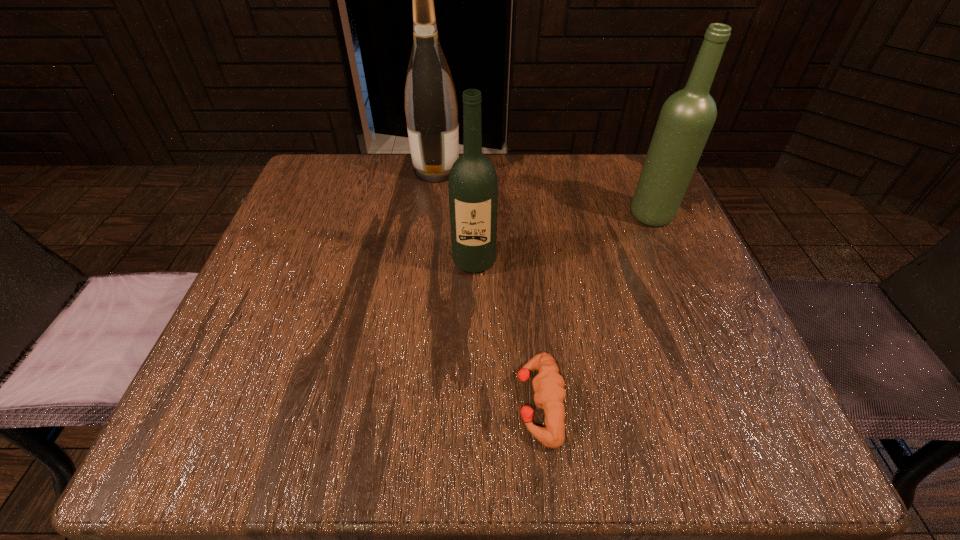
Locate an element on the screen. This screenshot has width=960, height=540. free space located 0.330m with the gloves of the puncher facing forward is located at coordinates (291, 403).

The height and width of the screenshot is (540, 960). Find the location of `free space located 0.390m with the gloves of the puncher facing forward`. free space located 0.390m with the gloves of the puncher facing forward is located at coordinates (250, 403).

You are a GUI agent. You are given a task and a screenshot of the screen. Output one action in this format:
    pyautogui.click(x=<x>, y=<y>)
    Task: Click on the object that is positioned at the near edge
    
    Given the screenshot: What is the action you would take?
    pyautogui.click(x=548, y=384)

The image size is (960, 540). What are the coordinates of `object at the right edge` in the screenshot? It's located at (687, 117).

Where is `object that is at the far right corner`? object that is at the far right corner is located at coordinates (687, 117).

In the image, there is a desktop. At what (x,y) coordinates should I click in order to perform the action: click on free space at the far edge. Please return your answer as a coordinate pair (x, y). The image size is (960, 540). Looking at the image, I should click on (529, 171).

The height and width of the screenshot is (540, 960). In the image, there is a desktop. In order to click on vacant area at the near edge in this screenshot , I will do `click(588, 439)`.

Identify the location of vacant region at the left edge. This screenshot has width=960, height=540. (291, 299).

Where is `vacant region at the right edge of the desktop`? The width and height of the screenshot is (960, 540). vacant region at the right edge of the desktop is located at coordinates point(650,249).

Image resolution: width=960 pixels, height=540 pixels. In the image, there is a desktop. Find the location of `vacant space at the far left corner`. vacant space at the far left corner is located at coordinates (362, 198).